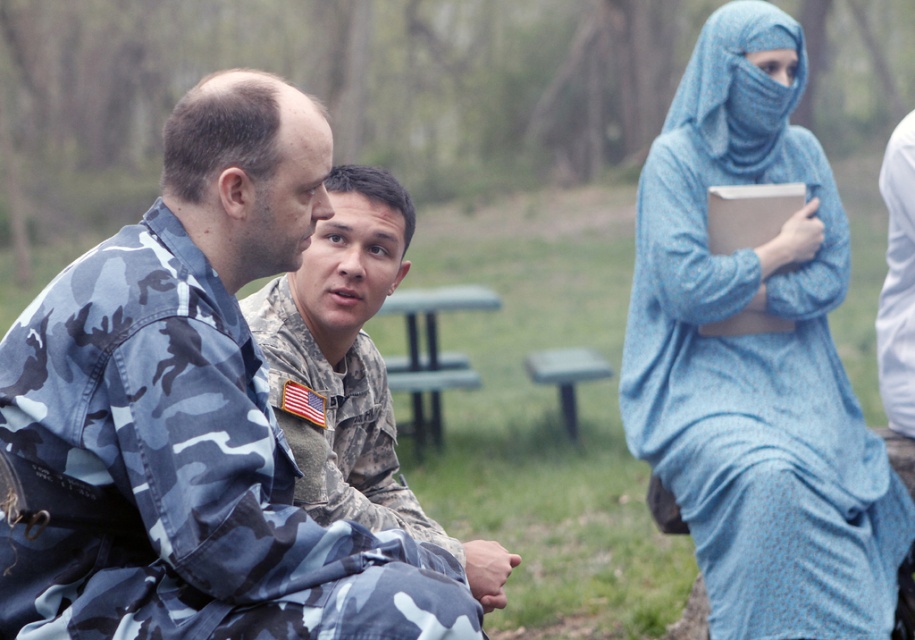
Question: Estimate the real-world distances between objects in this image. Which object is closer to the green plastic picnic table at center?

Choices:
 (A) camo fabric uniform at left
 (B) blue printed dress at right

Answer: (B)

Question: Which point is closer to the camera?

Choices:
 (A) (393, 296)
 (B) (832, 534)
 (C) (232, 368)
 (D) (373, 282)

Answer: (C)

Question: Is blue printed dress at right thinner than green plastic picnic table at center?

Choices:
 (A) no
 (B) yes

Answer: (A)

Question: Among these points, which one is farthest from the camera?

Choices:
 (A) (208, 544)
 (B) (684, 417)
 (C) (436, 300)
 (D) (285, 339)

Answer: (C)

Question: Is camouflage uniform at center in front of green plastic picnic table at center?

Choices:
 (A) yes
 (B) no

Answer: (A)

Question: Is camo fabric uniform at left bigger than blue printed dress at right?

Choices:
 (A) no
 (B) yes

Answer: (A)